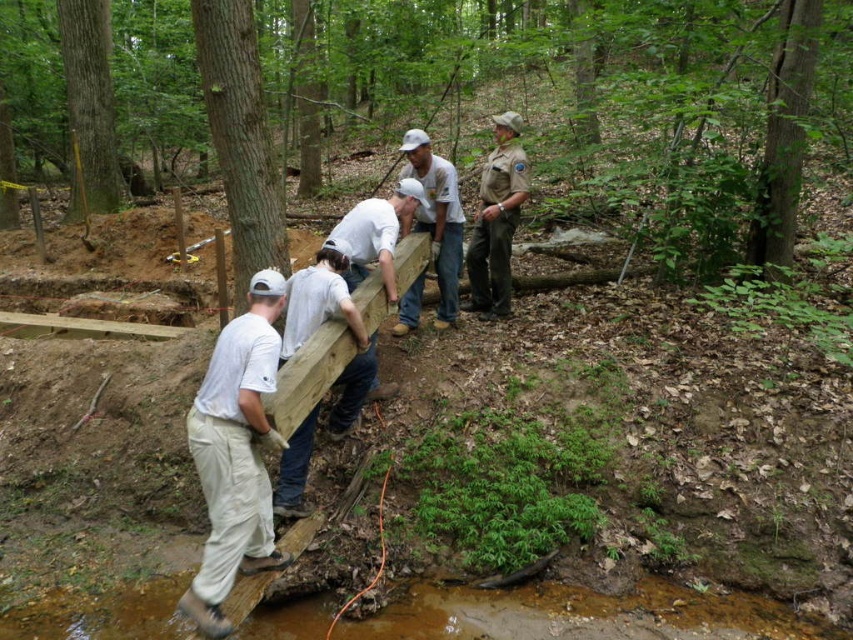
Is point (236, 540) closer to camera compared to point (334, 256)?

That is True.

Who is higher up, white cotton shirt at left or white matte wood at center?

white matte wood at center

Who is more forward, (x=210, y=579) or (x=332, y=408)?

Point (x=210, y=579)

Where is `white cotton shirt at left`? This screenshot has height=640, width=853. white cotton shirt at left is located at coordinates (235, 452).

Does white matte wood at center lie behind light brown uniform at center?

No, white matte wood at center is in front of light brown uniform at center.

Can you confirm if white matte wood at center is smaller than light brown uniform at center?

Yes, white matte wood at center is smaller than light brown uniform at center.

Find the location of a particular element. This screenshot has width=853, height=640. white matte wood at center is located at coordinates (323, 321).

The height and width of the screenshot is (640, 853). What are the coordinates of `white matte wood at center` in the screenshot? It's located at (323, 321).

Is light brown uniform at center to the right of white matte shirt at center from the viewer's perspective?

Correct, you'll find light brown uniform at center to the right of white matte shirt at center.

Find the location of a particular element. The image size is (853, 640). light brown uniform at center is located at coordinates (436, 216).